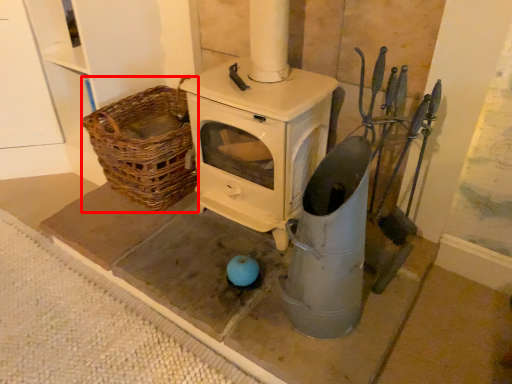
Question: From the image's perspective, where is basket (annotated by the red box) located in relation to appliance in the image?

Choices:
 (A) above
 (B) below

Answer: (A)